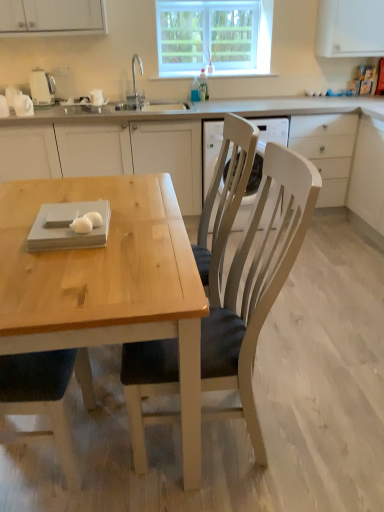
Question: Is wooden chair at center bigger or smaller than clear glass window at upper center?

Choices:
 (A) small
 (B) big

Answer: (B)

Question: Considering the positions of wooden chair at center and clear glass window at upper center in the image, is wooden chair at center taller or shorter than clear glass window at upper center?

Choices:
 (A) short
 (B) tall

Answer: (B)

Question: Based on their relative distances, which object is nearer to the white matte drawer at center right?

Choices:
 (A) white glossy egg at table, which is counted as the 1th food, starting from the back
 (B) wooden chair at center
 (C) clear glass window at upper center
 (D) white glossy egg at table, which is counted as the 2th food, starting from the back
 (E) white glossy electric kettle at upper left

Answer: (C)

Question: Which object is the farthest from the white matte drawer at center right?

Choices:
 (A) white glossy electric kettle at upper left
 (B) wooden chair at center
 (C) white glossy egg at table, which is counted as the 2th food, starting from the back
 (D) clear glass window at upper center
 (E) natural wood table at center

Answer: (C)